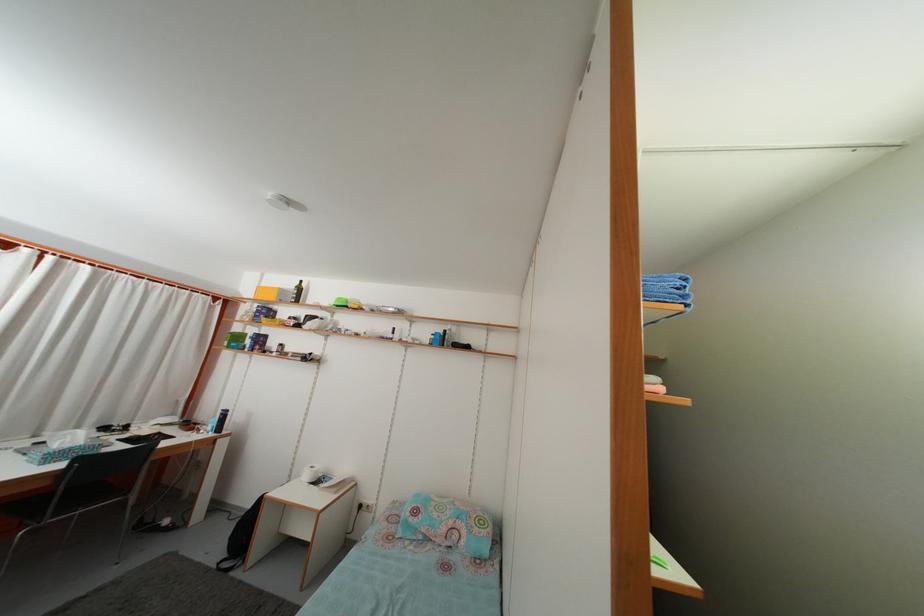
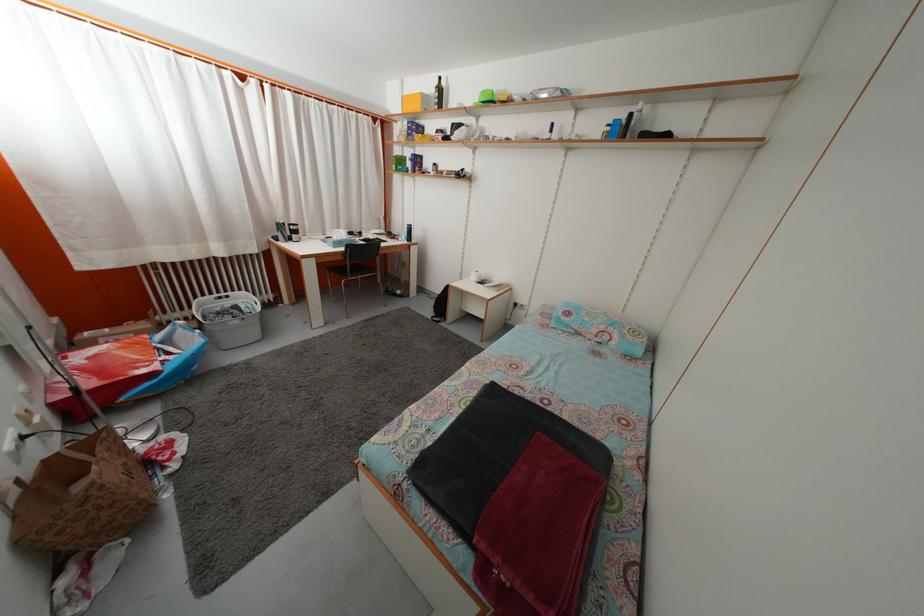
How did the camera likely rotate?

The rotation direction of the camera is left-down.